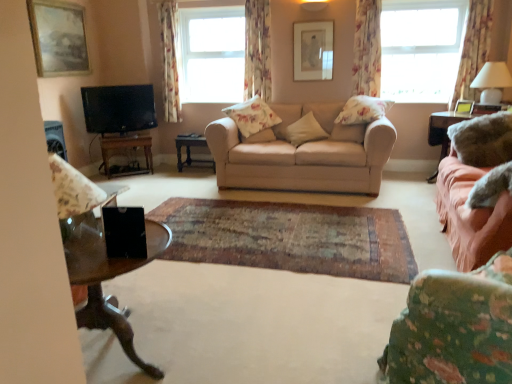
Question: Considering the positions of point (357, 92) and point (59, 158), is point (357, 92) closer or farther from the camera than point (59, 158)?

Choices:
 (A) closer
 (B) farther

Answer: (B)

Question: From a real-world perspective, relative to matte floral fabric armchair at left, is floral fabric curtain at right, marked as the second curtain in a right-to-left arrangement, vertically above or below?

Choices:
 (A) below
 (B) above

Answer: (B)

Question: Estimate the real-world distances between objects in this image. Which object is farther from the clear glass window at upper center, the 2th window positioned from the right?

Choices:
 (A) beige fabric couch at center, which ranks as the 2th studio couch in right-to-left order
 (B) transparent glass coffee table at lower left
 (C) fluffy beige pillow at center, the 3th pillow when ordered from right to left
 (D) velvet pink couch at right, acting as the 1th studio couch starting from the right
 (E) floral fabric curtain at upper right, marked as the 4th curtain in a left-to-right arrangement

Answer: (B)

Question: Which object is positioned farthest from the rug at center?

Choices:
 (A) wooden picture frame at upper left, which is the first picture frame from left to right
 (B) transparent glass window at upper right, placed as the 1th window when sorted from front to back
 (C) wooden table at left, the third table when ordered from right to left
 (D) metallic gold picture frame at upper right, marked as the first picture frame in a right-to-left arrangement
 (E) fluffy white pillow at center, which ranks as the 4th pillow in left-to-right order

Answer: (B)